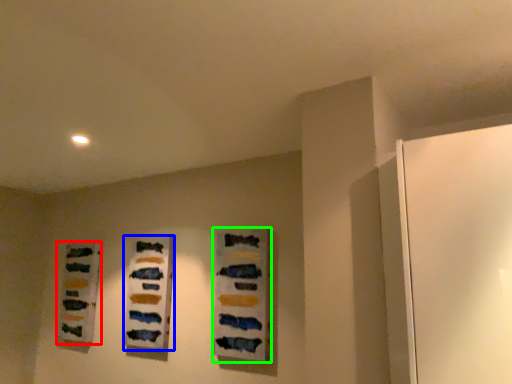
Question: Based on their relative distances, which object is nearer to art (highlighted by a red box)? Choose from art (highlighted by a blue box) and art (highlighted by a green box).

Choices:
 (A) art
 (B) art

Answer: (A)